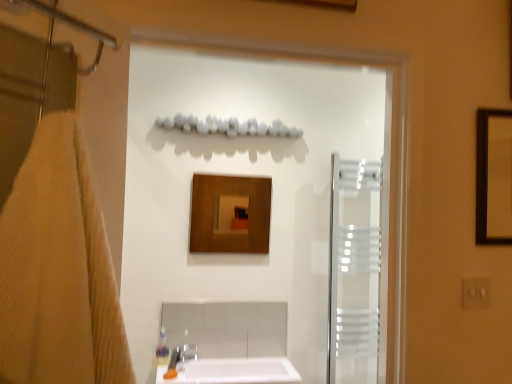
Question: Should I look upward or downward to see white glossy sink at lower center?

Choices:
 (A) down
 (B) up

Answer: (A)

Question: Is translucent frosted glass screen door at right, placed as the second screen door when sorted from left to right, taller than beige textured towel at left?

Choices:
 (A) no
 (B) yes

Answer: (B)

Question: Is translucent frosted glass screen door at right, which is the 1th screen door in right-to-left order, positioned behind beige textured towel at left?

Choices:
 (A) yes
 (B) no

Answer: (A)

Question: Is translucent frosted glass screen door at right, positioned as the first screen door in back-to-front order, not within beige textured towel at left?

Choices:
 (A) no
 (B) yes

Answer: (B)

Question: Does translucent frosted glass screen door at right, placed as the second screen door when sorted from left to right, have a smaller size compared to beige textured towel at left?

Choices:
 (A) yes
 (B) no

Answer: (A)

Question: Does translucent frosted glass screen door at right, positioned as the first screen door in back-to-front order, touch beige textured towel at left?

Choices:
 (A) no
 (B) yes

Answer: (A)

Question: Does translucent frosted glass screen door at right, placed as the second screen door when sorted from left to right, come in front of beige textured towel at left?

Choices:
 (A) no
 (B) yes

Answer: (A)

Question: Is translucent frosted glass screen door at right, which is the 1th screen door in right-to-left order, to the right of transparent glass screen door at center, which is the second screen door from right to left, from the viewer's perspective?

Choices:
 (A) yes
 (B) no

Answer: (A)

Question: Does translucent frosted glass screen door at right, placed as the second screen door when sorted from left to right, lie in front of transparent glass screen door at center, which is the second screen door from right to left?

Choices:
 (A) no
 (B) yes

Answer: (A)

Question: Does translucent frosted glass screen door at right, acting as the second screen door starting from the front, lie behind transparent glass screen door at center, which is the second screen door from right to left?

Choices:
 (A) no
 (B) yes

Answer: (B)

Question: From a real-world perspective, is translucent frosted glass screen door at right, acting as the second screen door starting from the front, located beneath transparent glass screen door at center, placed as the 2th screen door when sorted from back to front?

Choices:
 (A) yes
 (B) no

Answer: (A)

Question: Is translucent frosted glass screen door at right, acting as the second screen door starting from the front, located outside transparent glass screen door at center, placed as the 2th screen door when sorted from back to front?

Choices:
 (A) no
 (B) yes

Answer: (B)

Question: Would you say translucent frosted glass screen door at right, acting as the second screen door starting from the front, contains transparent glass screen door at center, which is the second screen door from right to left?

Choices:
 (A) yes
 (B) no

Answer: (B)

Question: Is transparent glass screen door at center, the 1th screen door when ordered from front to back, taller than beige textured towel at left?

Choices:
 (A) no
 (B) yes

Answer: (B)